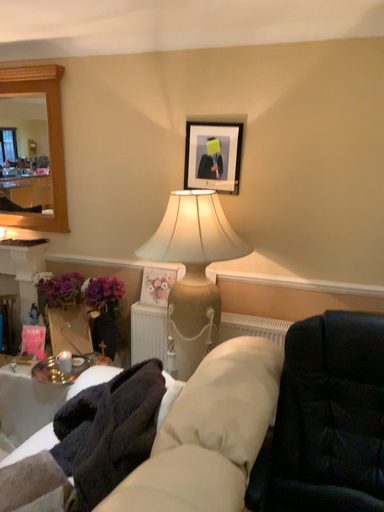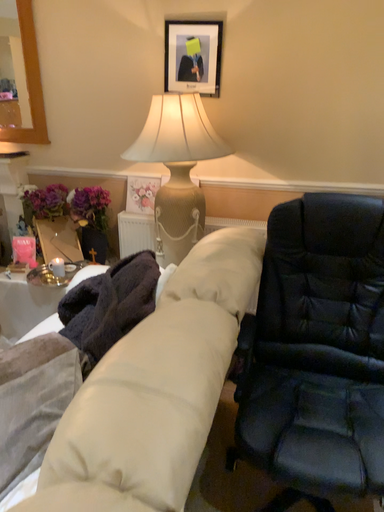
Question: How did the camera likely rotate when shooting the video?

Choices:
 (A) rotated upward
 (B) rotated downward

Answer: (B)